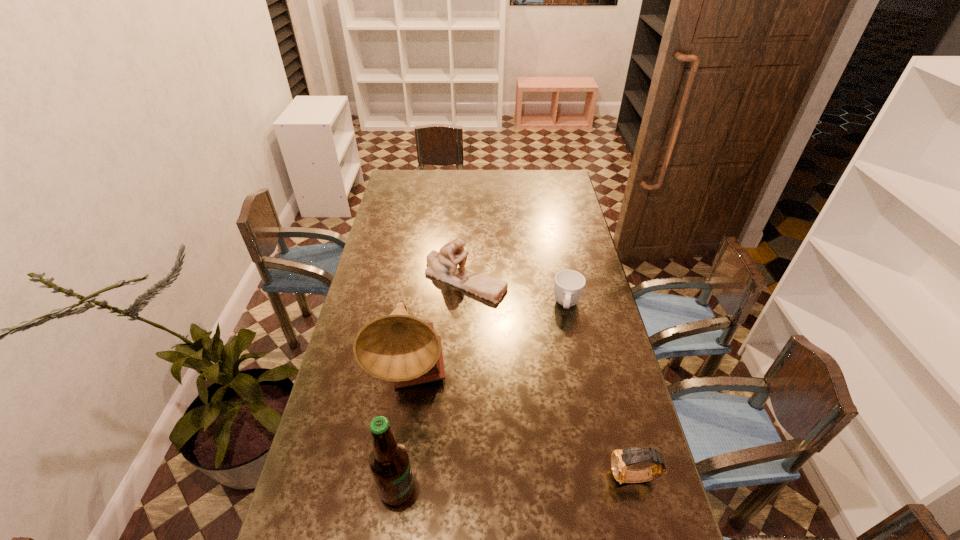
Locate an element on the screen. The height and width of the screenshot is (540, 960). free space on the desktop that is between the fourth shortest object and the watch and is positioned on the front-facing side of the figurine is located at coordinates (538, 482).

The image size is (960, 540). Find the location of `vacant space on the desktop that is between the fourth shortest object and the watch and is positioned with the handle on the side of the cup`. vacant space on the desktop that is between the fourth shortest object and the watch and is positioned with the handle on the side of the cup is located at coordinates (552, 482).

Identify the location of free space on the desktop that is between the beer bottle and the watch and is positioned on the horn of the tallest object. The image size is (960, 540). (497, 484).